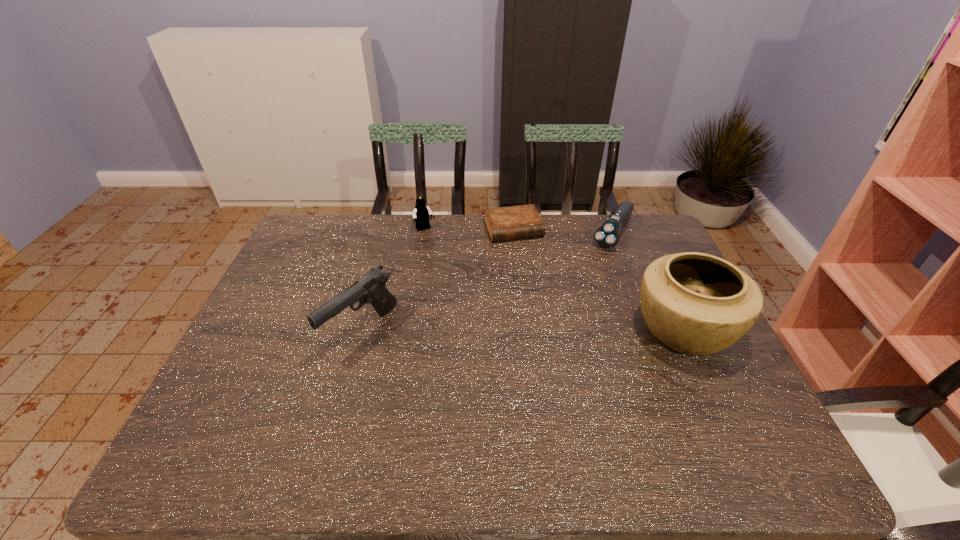
The height and width of the screenshot is (540, 960). I want to click on free space located on the head of the second shortest object, so click(580, 286).

The image size is (960, 540). I want to click on vacant position located 0.130m on the head of the second shortest object, so [590, 272].

At what (x,y) coordinates should I click in order to perform the action: click on free space located 0.330m on the head of the second shortest object. Please return your answer as a coordinate pair (x, y). Looking at the image, I should click on (563, 310).

Image resolution: width=960 pixels, height=540 pixels. In order to click on free space located on the spine side of the shortest object in this screenshot , I will do [549, 307].

You are a GUI agent. You are given a task and a screenshot of the screen. Output one action in this format:
    pyautogui.click(x=<x>, y=<y>)
    Task: Click on the blank area located on the spine side of the shortest object
    
    Given the screenshot: What is the action you would take?
    tap(550, 309)

The height and width of the screenshot is (540, 960). Identify the location of free region located 0.230m on the spine side of the shortest object. coord(541,290).

Locate an element on the screen. Image resolution: width=960 pixels, height=540 pixels. free location located 0.260m on the front-facing side of the second object from left to right is located at coordinates (457, 280).

The image size is (960, 540). What are the coordinates of `free spot located on the front-facing side of the second object from left to right` in the screenshot? It's located at (468, 297).

Identify the location of vacant space located on the front-facing side of the second object from left to right. This screenshot has width=960, height=540. (452, 272).

This screenshot has height=540, width=960. Find the location of `electric shaver that is at the far edge`. electric shaver that is at the far edge is located at coordinates (607, 235).